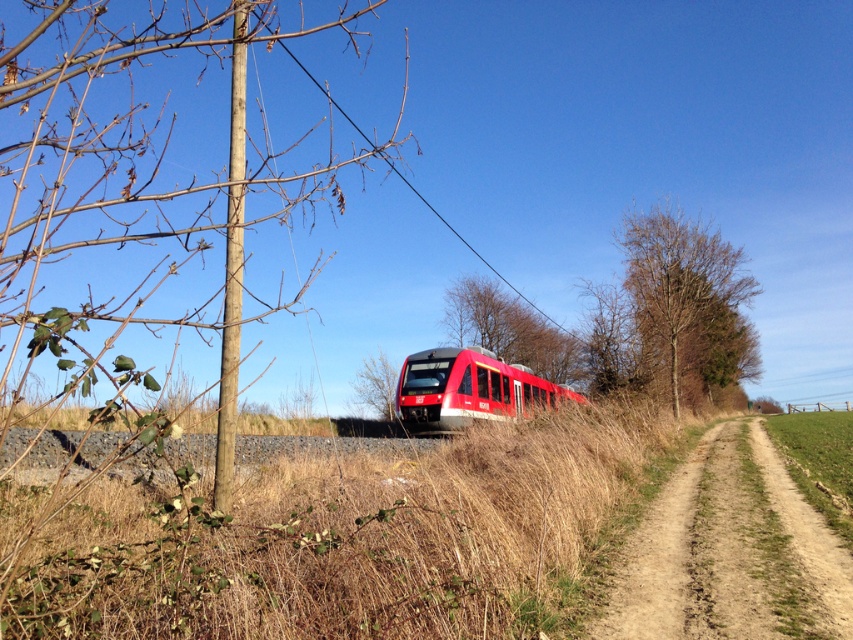
Is bare wood tree at right shorter than red matte train at center?

Incorrect, bare wood tree at right's height does not fall short of red matte train at center's.

Does bare wood tree at right appear on the right side of red matte train at center?

Correct, you'll find bare wood tree at right to the right of red matte train at center.

Which is in front, point (665, 356) or point (531, 406)?

Point (665, 356) is in front.

Where is `bare wood tree at right`? This screenshot has width=853, height=640. bare wood tree at right is located at coordinates (688, 301).

Based on the photo, between smooth wooden pole at center-left and black wire at upper center, which one is positioned lower?

smooth wooden pole at center-left is below.

Does smooth wooden pole at center-left appear over black wire at upper center?

No.

Between point (227, 502) and point (305, 67), which one is positioned in front?

Point (227, 502) is more forward.

What are the coordinates of `smooth wooden pole at center-left` in the screenshot? It's located at (231, 268).

Is point (33, 568) farther from viewer compared to point (647, 522)?

No, it is not.

Which is in front, point (474, 502) or point (764, 604)?

Positioned in front is point (764, 604).

This screenshot has height=640, width=853. Describe the element at coordinates (357, 540) in the screenshot. I see `dry grass at center` at that location.

Find the location of `dry grass at center`. dry grass at center is located at coordinates (357, 540).